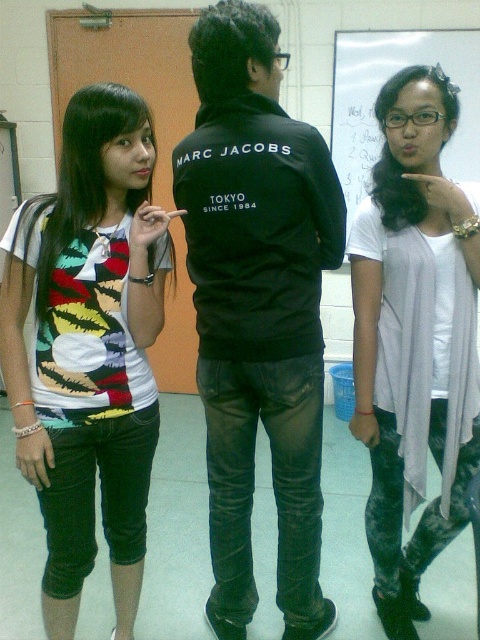
You are organizing a small event and need to decide which item to place on a table that can only accommodate one large item. You have the light gray sheer cardigan at center and the white paper at upper center. Based on their sizes, which item should you choose?

The light gray sheer cardigan at center is bigger than the white paper at upper center, so you should choose the light gray sheer cardigan at center to place on the table since it is the larger item.

You are standing at point (396, 80) and want to walk to point (222, 227). Is there any obstruction between you and your destination?

Point (222, 227) is in front of point (396, 80), so there is no obstruction between them. You can walk directly to your destination.